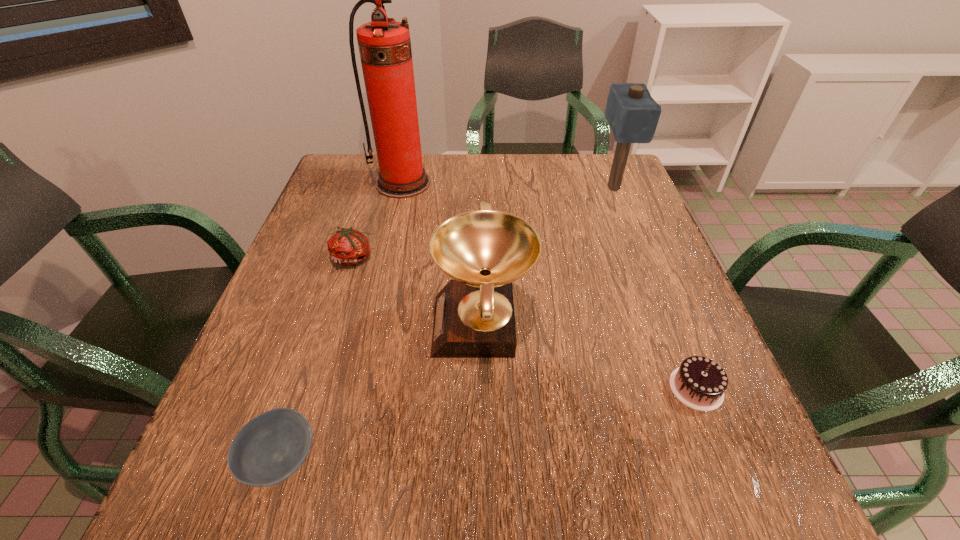
This screenshot has height=540, width=960. I want to click on vacant point located on the front-facing side of the award, so click(x=342, y=326).

Where is `free space located 0.170m on the front-facing side of the award`? This screenshot has height=540, width=960. free space located 0.170m on the front-facing side of the award is located at coordinates (351, 326).

Locate an element on the screen. This screenshot has height=540, width=960. free spot located on the front-facing side of the award is located at coordinates (347, 326).

Identify the location of vacant space situated on the front of the tomato. (312, 394).

Find the location of a particular element. The image size is (960, 540). free spot located 0.290m on the left of the chocolate cake is located at coordinates (512, 388).

Image resolution: width=960 pixels, height=540 pixels. In order to click on vacant space located 0.300m on the right of the shortest object in this screenshot , I will do `click(505, 459)`.

Where is `fire extinguisher that is at the far edge`? The width and height of the screenshot is (960, 540). fire extinguisher that is at the far edge is located at coordinates (384, 44).

Where is `mallet located at the far edge`? This screenshot has width=960, height=540. mallet located at the far edge is located at coordinates (632, 113).

The image size is (960, 540). Identify the location of object present at the near edge. (267, 450).

The image size is (960, 540). I want to click on fire extinguisher at the left edge, so click(384, 44).